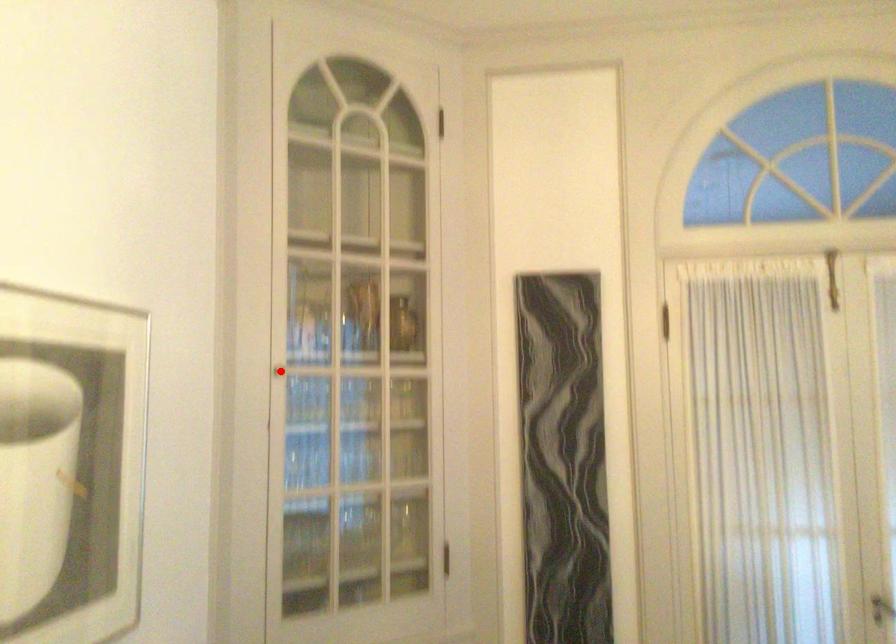
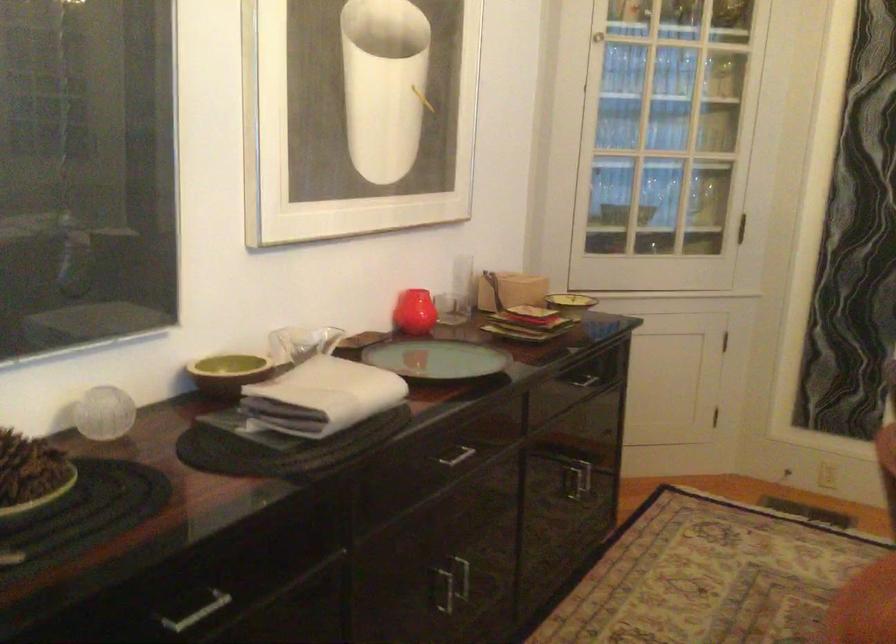
Locate, in the second image, the point that corresponds to the highlighted location in the first image.

(597, 37)